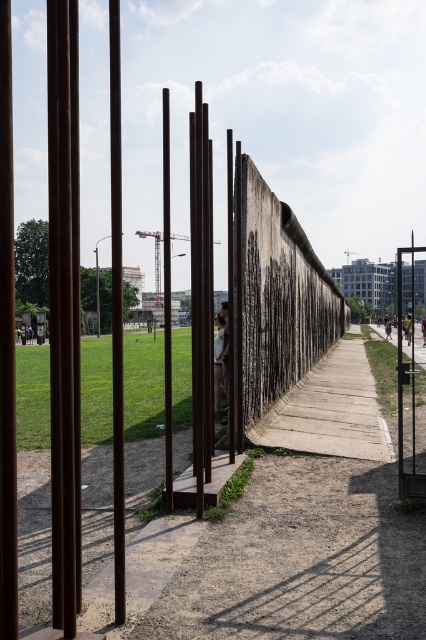
In the scene shown: You are standing at the Berlin Wall monument and want to take a photo of the wall without any obstructions. The rusty metal pole at left is in your way. Where should you move to avoid it?

Move to the right side of the scene since the rusty metal pole at left is positioned at point (x=63, y=308), which is on the left side, so moving right would allow you to avoid it.

You are a visitor standing in front of the Berlin Wall. You notice two poles nearby. The first is a rusty metal pole at left, and the second is a smooth brown pole at center. Which pole is shorter?

The rusty metal pole at left is shorter than the smooth brown pole at center.

You are a tourist standing in front of the Berlin Wall. You want to take a photo of the weathered concrete wall at center. Where should you position yourself to capture the wall in the center of your photo?

You should position yourself directly in front of the weathered concrete wall at center, which is located at point (279, 298), to ensure it appears centered in your photo.